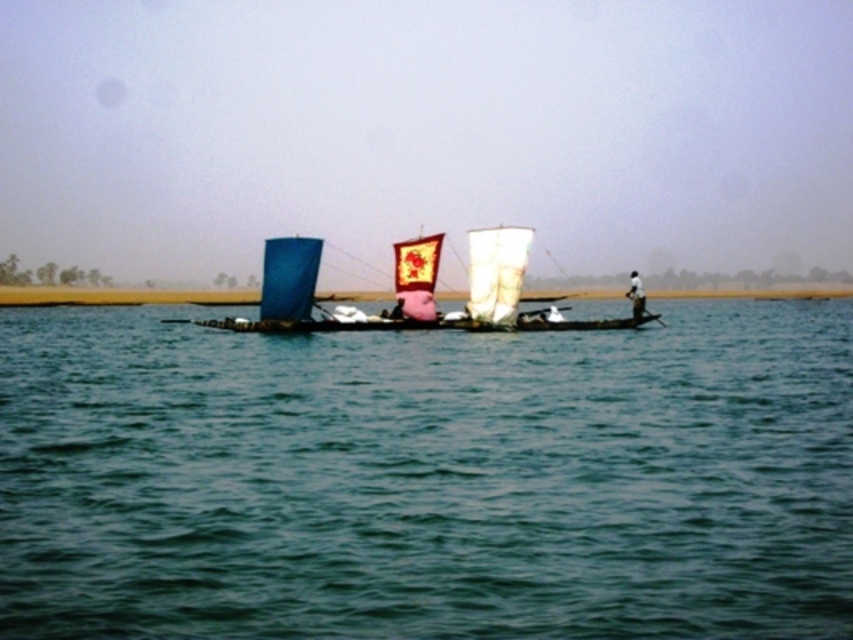
You are standing on the shore and see the green water at center and the blue fabric sailboat at center. Which object is positioned to the right of the other?

The green water at center is to the right of blue fabric sailboat at center.

You are a sailor trying to navigate your boat to the center of the water. Based on the scene, can your white fabric boat at right fit into the green water at center without any issues?

The green water at center has a larger size compared to white fabric boat at right, so yes, the white fabric boat at right can fit into the green water at center without any issues.